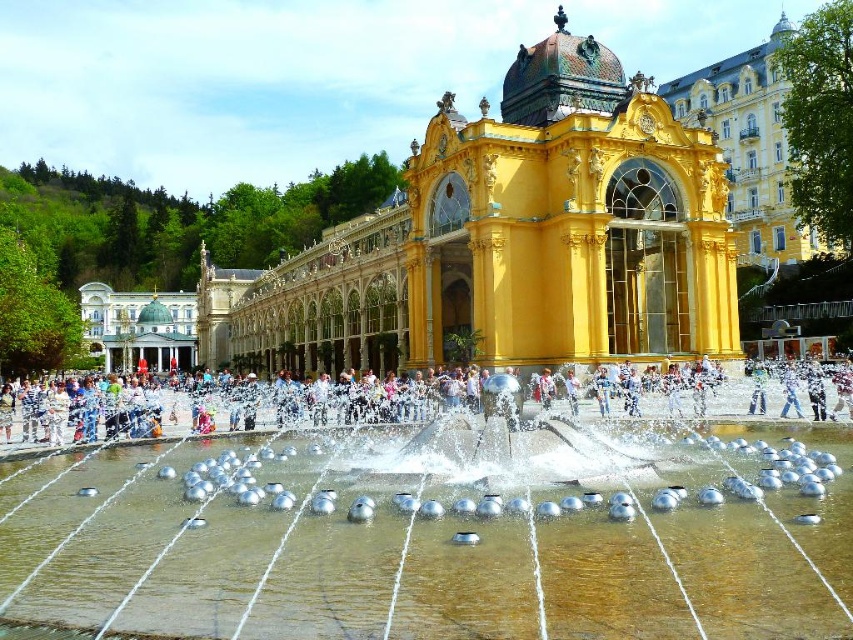
You are standing in front of the grand structure and want to take a photo that includes both the silver metallic water at center and the golden glass palace at center. Which object should you position closer to the front of your camera frame?

You should position the silver metallic water at center closer to the front of your camera frame since it is closer to the viewer than the golden glass palace at center.

You are standing in front of the grand golden building and want to avoid getting wet. The silver metallic water at center is part of the fountain. Where should you stand to stay dry?

To avoid getting wet, you should stand away from the silver metallic water at center, which is located at point (434, 538). Since the fountain has water jets shooting upwards and outwards, staying clear of this area will help you remain dry.